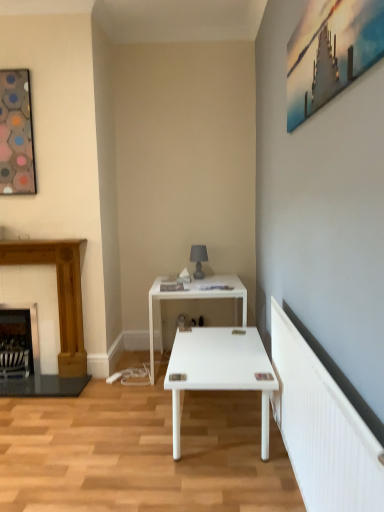
The image size is (384, 512). In order to click on white glossy table at center in this screenshot , I will do `click(195, 298)`.

At what (x,y) coordinates should I click in order to perform the action: click on dark wood fireplace at left, which is the second fireplace from right to left. Please return your answer as a coordinate pair (x, y). The width and height of the screenshot is (384, 512). Looking at the image, I should click on (19, 341).

This screenshot has height=512, width=384. Describe the element at coordinates (19, 341) in the screenshot. I see `dark wood fireplace at left, which is the second fireplace from right to left` at that location.

In order to face wooden fireplace at left, arranged as the 2th fireplace when viewed from the left, should I rotate leftwards or rightwards?

To align with it, rotate left about 19.848°.

Image resolution: width=384 pixels, height=512 pixels. What do you see at coordinates (16, 134) in the screenshot?
I see `hexagonal mosaic frame at upper left, which appears as the second picture frame when viewed from the right` at bounding box center [16, 134].

This screenshot has width=384, height=512. I want to click on white glossy table at center, so click(195, 298).

Is matte gray table lamp at center facing towards dark wood fireplace at left, acting as the 1th fireplace starting from the left?

No, matte gray table lamp at center is not turned towards dark wood fireplace at left, acting as the 1th fireplace starting from the left.

Identify the location of table lamp located above the dark wood fireplace at left, acting as the 1th fireplace starting from the left (from a real-world perspective). (198, 259).

Is matte gray table lamp at center outside of dark wood fireplace at left, which is the second fireplace from right to left?

That's correct, matte gray table lamp at center is outside of dark wood fireplace at left, which is the second fireplace from right to left.

What's the angular difference between matte gray table lamp at center and dark wood fireplace at left, acting as the 1th fireplace starting from the left,'s facing directions?

The facing directions of matte gray table lamp at center and dark wood fireplace at left, acting as the 1th fireplace starting from the left, are 0.75 degrees apart.

In the scene shown: Is hexagonal mosaic frame at upper left, positioned as the first picture frame in back-to-front order, not close to white glossy table at center?

hexagonal mosaic frame at upper left, positioned as the first picture frame in back-to-front order, is far away from white glossy table at center.

Which is less distant, [7,147] or [162,352]?

The point [7,147] is closer.

Is hexagonal mosaic frame at upper left, the 1th picture frame in the left-to-right sequence, to the left of white glossy table at center from the viewer's perspective?

Yes, hexagonal mosaic frame at upper left, the 1th picture frame in the left-to-right sequence, is to the left of white glossy table at center.

Is hexagonal mosaic frame at upper left, which is the second picture frame in front-to-back order, outside of white glossy table at center?

Yes, hexagonal mosaic frame at upper left, which is the second picture frame in front-to-back order, is not within white glossy table at center.

Does hexagonal mosaic frame at upper left, which appears as the second picture frame when viewed from the right, have a greater height compared to metallic silver painting at upper right, the 1th picture frame from the right?

Yes.

From the image's perspective, is hexagonal mosaic frame at upper left, the 1th picture frame in the left-to-right sequence, on metallic silver painting at upper right, the second picture frame from the back?

Yes, from the image's perspective, hexagonal mosaic frame at upper left, the 1th picture frame in the left-to-right sequence, is above metallic silver painting at upper right, the second picture frame from the back.

Which object is positioned more to the left, white glossy table at center or dark wood fireplace at left, which is the second fireplace from right to left?

dark wood fireplace at left, which is the second fireplace from right to left, is more to the left.

Is white glossy table at center next to dark wood fireplace at left, acting as the 1th fireplace starting from the left?

No.

From a real-world perspective, which object rests below the other?

In real-world perspective, dark wood fireplace at left, acting as the 1th fireplace starting from the left, is lower.

Based on the photo, considering the relative positions of metallic silver painting at upper right, marked as the first picture frame in a front-to-back arrangement, and white glossy table at center in the image provided, is metallic silver painting at upper right, marked as the first picture frame in a front-to-back arrangement, to the left or to the right of white glossy table at center?

metallic silver painting at upper right, marked as the first picture frame in a front-to-back arrangement, is to the right of white glossy table at center.

Is point (288, 44) closer to camera compared to point (150, 307)?

Yes, point (288, 44) is in front of point (150, 307).

Find the location of `table lying on the left of metallic silver painting at upper right, the 1th picture frame from the right`. table lying on the left of metallic silver painting at upper right, the 1th picture frame from the right is located at coordinates pos(195,298).

Consider the image. In terms of height, does metallic silver painting at upper right, marked as the 2th picture frame in a left-to-right arrangement, look taller or shorter compared to white glossy table at center?

In the image, metallic silver painting at upper right, marked as the 2th picture frame in a left-to-right arrangement, appears to be shorter than white glossy table at center.

Can you confirm if matte gray table lamp at center is smaller than wooden fireplace at left, acting as the first fireplace starting from the right?

Correct, matte gray table lamp at center occupies less space than wooden fireplace at left, acting as the first fireplace starting from the right.

Considering the relative sizes of matte gray table lamp at center and wooden fireplace at left, arranged as the 2th fireplace when viewed from the left, in the image provided, is matte gray table lamp at center wider than wooden fireplace at left, arranged as the 2th fireplace when viewed from the left,?

Incorrect, the width of matte gray table lamp at center does not surpass that of wooden fireplace at left, arranged as the 2th fireplace when viewed from the left.

From a real-world perspective, which object rests below the other?

wooden fireplace at left, arranged as the 2th fireplace when viewed from the left.

The image size is (384, 512). There is a wooden fireplace at left, acting as the first fireplace starting from the right. Find the location of `table lamp above it (from a real-world perspective)`. table lamp above it (from a real-world perspective) is located at coordinates click(x=198, y=259).

From a real-world perspective, who is located lower, matte gray table lamp at center or metallic silver painting at upper right, the second picture frame from the back?

In real-world perspective, matte gray table lamp at center is lower.

Considering the positions of objects matte gray table lamp at center and metallic silver painting at upper right, the 1th picture frame from the right, in the image provided, who is behind, matte gray table lamp at center or metallic silver painting at upper right, the 1th picture frame from the right,?

matte gray table lamp at center is behind.

Are matte gray table lamp at center and metallic silver painting at upper right, marked as the 2th picture frame in a left-to-right arrangement, located far from each other?

Yes.

Find the location of a particular element. This screenshot has height=512, width=384. picture frame that is the 2nd one above the matte gray table lamp at center (from a real-world perspective) is located at coordinates (330, 52).

In order to click on the 2nd fireplace below the matte gray table lamp at center (from a real-world perspective) in this screenshot , I will do `click(19, 341)`.

The image size is (384, 512). I want to click on table to the right of hexagonal mosaic frame at upper left, positioned as the first picture frame in back-to-front order, so click(x=195, y=298).

Considering their positions, is metallic silver painting at upper right, marked as the first picture frame in a front-to-back arrangement, positioned closer to white glossy table at center than matte gray table lamp at center?

matte gray table lamp at center.

Which object lies nearer to the anchor point matte gray table lamp at center, white glossy table at center or wooden fireplace at left, acting as the first fireplace starting from the right?

white glossy table at center is positioned closer to the anchor matte gray table lamp at center.

Estimate the real-world distances between objects in this image. Which object is closer to white glossy table at center, dark wood fireplace at left, which is the second fireplace from right to left, or metallic silver painting at upper right, the 1th picture frame from the right?

Among the two, dark wood fireplace at left, which is the second fireplace from right to left, is located nearer to white glossy table at center.

Considering their positions, is white glossy table at center positioned further to dark wood fireplace at left, which is the second fireplace from right to left, than hexagonal mosaic frame at upper left, the 1th picture frame in the left-to-right sequence?

Based on the image, hexagonal mosaic frame at upper left, the 1th picture frame in the left-to-right sequence, appears to be further to dark wood fireplace at left, which is the second fireplace from right to left.

From the image, which object appears to be farther from white glossy table at center, matte gray table lamp at center or hexagonal mosaic frame at upper left, which is the second picture frame in front-to-back order?

hexagonal mosaic frame at upper left, which is the second picture frame in front-to-back order, is further to white glossy table at center.

When comparing their distances from hexagonal mosaic frame at upper left, which appears as the second picture frame when viewed from the right, does matte gray table lamp at center or dark wood fireplace at left, acting as the 1th fireplace starting from the left, seem further?

matte gray table lamp at center lies further to hexagonal mosaic frame at upper left, which appears as the second picture frame when viewed from the right, than the other object.

Based on their spatial positions, is wooden fireplace at left, arranged as the 2th fireplace when viewed from the left, or metallic silver painting at upper right, marked as the 2th picture frame in a left-to-right arrangement, closer to white glossy table at center?

→ wooden fireplace at left, arranged as the 2th fireplace when viewed from the left, is closer to white glossy table at center.

Looking at the image, which one is located closer to metallic silver painting at upper right, marked as the 2th picture frame in a left-to-right arrangement, hexagonal mosaic frame at upper left, which is the second picture frame in front-to-back order, or white glossy table at center?

Based on the image, white glossy table at center appears to be nearer to metallic silver painting at upper right, marked as the 2th picture frame in a left-to-right arrangement.

Locate an element on the screen. The image size is (384, 512). fireplace located between hexagonal mosaic frame at upper left, which appears as the second picture frame when viewed from the right, and matte gray table lamp at center in the left-right direction is located at coordinates (58, 293).

Locate an element on the screen. fireplace between hexagonal mosaic frame at upper left, which is the second picture frame in front-to-back order, and white glossy table at center in the up-down direction is located at coordinates (58, 293).

This screenshot has width=384, height=512. Identify the location of table between hexagonal mosaic frame at upper left, which is the second picture frame in front-to-back order, and dark wood fireplace at left, which is the second fireplace from right to left, in the up-down direction. (195, 298).

What are the coordinates of `table between metallic silver painting at upper right, the second picture frame from the back, and matte gray table lamp at center in the front-back direction` in the screenshot? It's located at (195, 298).